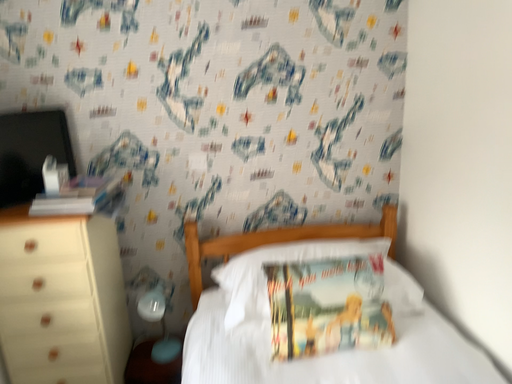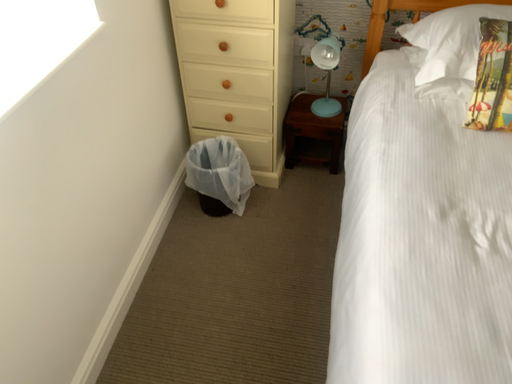
Question: How did the camera likely rotate when shooting the video?

Choices:
 (A) rotated downward
 (B) rotated upward

Answer: (A)